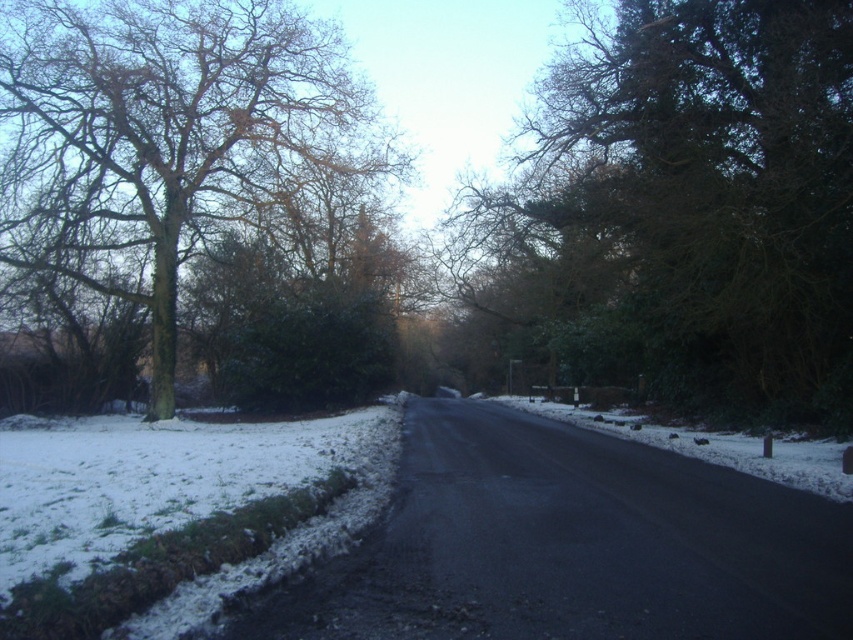
Does green leafy tree at left have a larger size compared to white fluffy snow at lower left?

Yes.

Does green leafy tree at left appear over white fluffy snow at lower left?

Indeed, green leafy tree at left is positioned over white fluffy snow at lower left.

Where is `green leafy tree at left`? The image size is (853, 640). green leafy tree at left is located at coordinates (165, 136).

Does green leafy tree at center lie behind white fluffy snow at lower left?

That is True.

Does point (782, 74) come farther from viewer compared to point (241, 561)?

Yes.

Which is in front, point (779, 285) or point (96, 484)?

Positioned in front is point (96, 484).

The height and width of the screenshot is (640, 853). What are the coordinates of `green leafy tree at center` in the screenshot? It's located at 683,211.

Does green leafy tree at center have a greater width compared to green leafy tree at left?

No, green leafy tree at center is not wider than green leafy tree at left.

Which is behind, point (753, 26) or point (160, 243)?

The point (160, 243) is more distant.

This screenshot has height=640, width=853. What do you see at coordinates (683, 211) in the screenshot? I see `green leafy tree at center` at bounding box center [683, 211].

The width and height of the screenshot is (853, 640). Identify the location of green leafy tree at center. (683, 211).